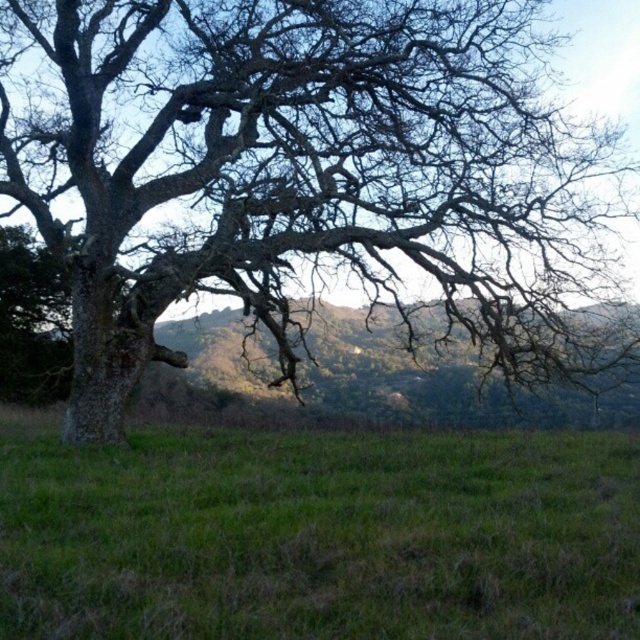
You are a landscape photographer planning to capture the entire scene in one shot. Given that the bare wood tree at left is wider than the green grassy field at center, will the tree occupy more space in the photo compared to the field?

The bare wood tree at left is wider than the green grassy field at center, so yes, the tree will occupy more space in the photo compared to the field.

You are a hiker standing in the green grassy field at center. You want to take a photo of the bare wood tree at left. Which direction should you face to capture the tree in your camera view?

The bare wood tree at left is taller than the green grassy field at center, so you should face towards the left to capture the tree in your camera view.